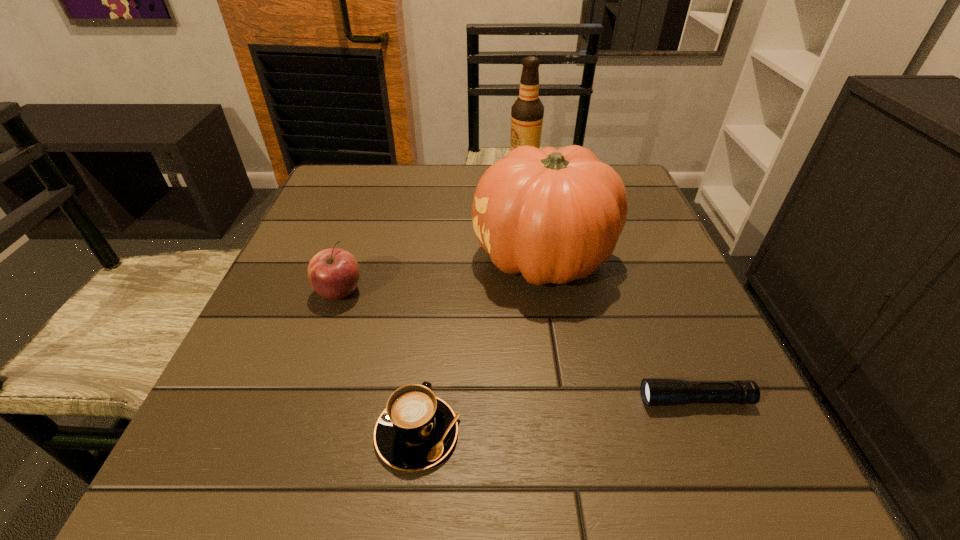
The width and height of the screenshot is (960, 540). Find the location of `object at the near edge`. object at the near edge is located at coordinates (417, 430).

Identify the location of object present at the left edge. (333, 273).

Identify the location of pumpkin situated at the right edge. (555, 216).

Locate an element on the screen. flashlight situated at the right edge is located at coordinates (654, 391).

At what (x,y) coordinates should I click in order to perform the action: click on vacant space at the far edge of the desktop. Please return your answer as a coordinate pair (x, y). This screenshot has width=960, height=540. Looking at the image, I should click on (407, 188).

This screenshot has height=540, width=960. Find the location of `blank area at the left edge`. blank area at the left edge is located at coordinates (317, 245).

Identify the location of vacant space at the right edge of the desktop. The width and height of the screenshot is (960, 540). (750, 428).

Identify the location of vacant point at the far left corner. (332, 213).

The width and height of the screenshot is (960, 540). What are the coordinates of `vacant space at the near left corner of the desktop` in the screenshot? It's located at (246, 453).

You are a GUI agent. You are given a task and a screenshot of the screen. Output one action in this format:
    pyautogui.click(x=<x>, y=<y>)
    Task: Click on the free area in between the second shortest object and the leftmost object
    The width and height of the screenshot is (960, 540).
    Given the screenshot: What is the action you would take?
    pyautogui.click(x=378, y=363)